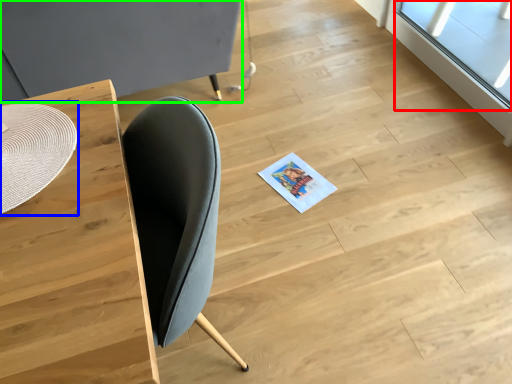
Question: Which object is the closest to the window (highlighted by a red box)? Choose among these: round table (highlighted by a blue box) or round table (highlighted by a green box).

Choices:
 (A) round table
 (B) round table

Answer: (B)